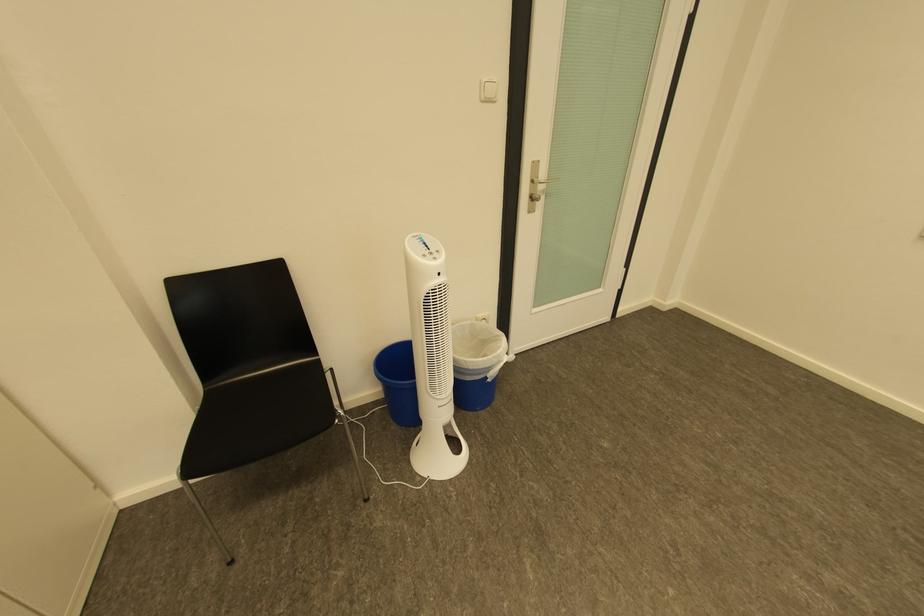
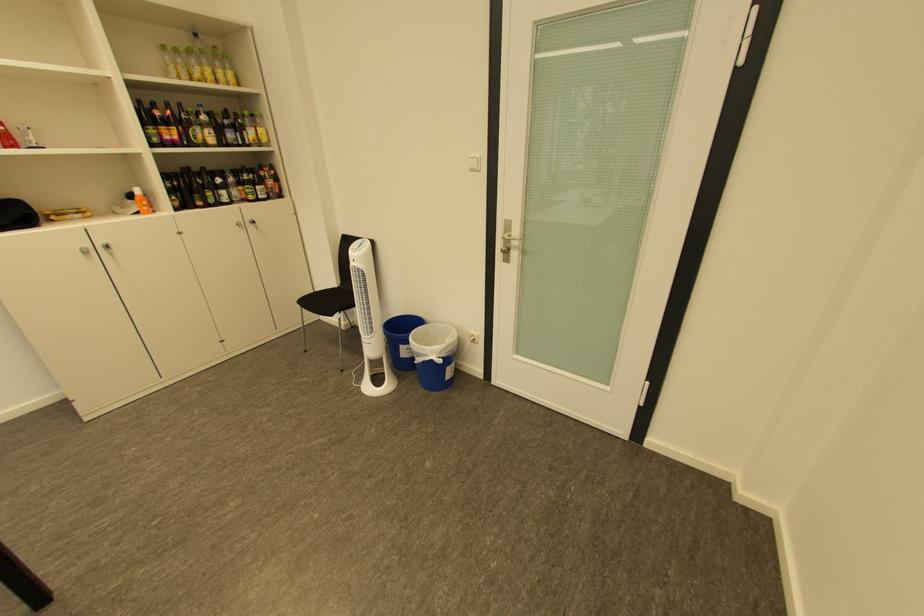
The point at [445,259] is marked in the first image. Where is the corresponding point in the second image?

(363, 253)